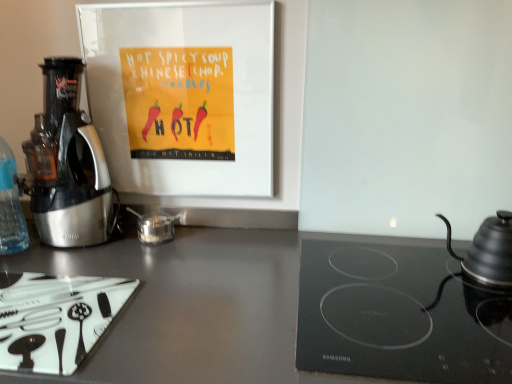
Find the location of a particular element. The image size is (512, 384). unoccupied region to the right of white glossy cutting board at lower left, marked as the first kitchen appliance in a left-to-right arrangement is located at coordinates (187, 314).